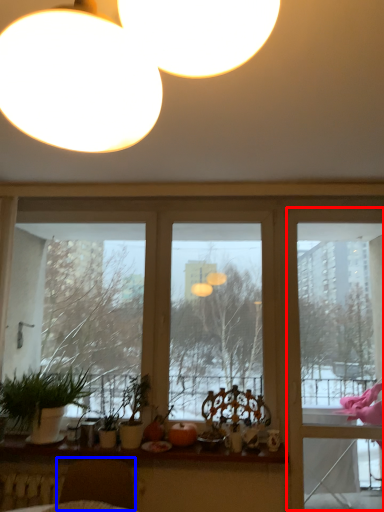
Question: Which object appears farthest to the camera in this image, screen door (highlighted by a red box) or swivel chair (highlighted by a blue box)?

Choices:
 (A) screen door
 (B) swivel chair

Answer: (A)